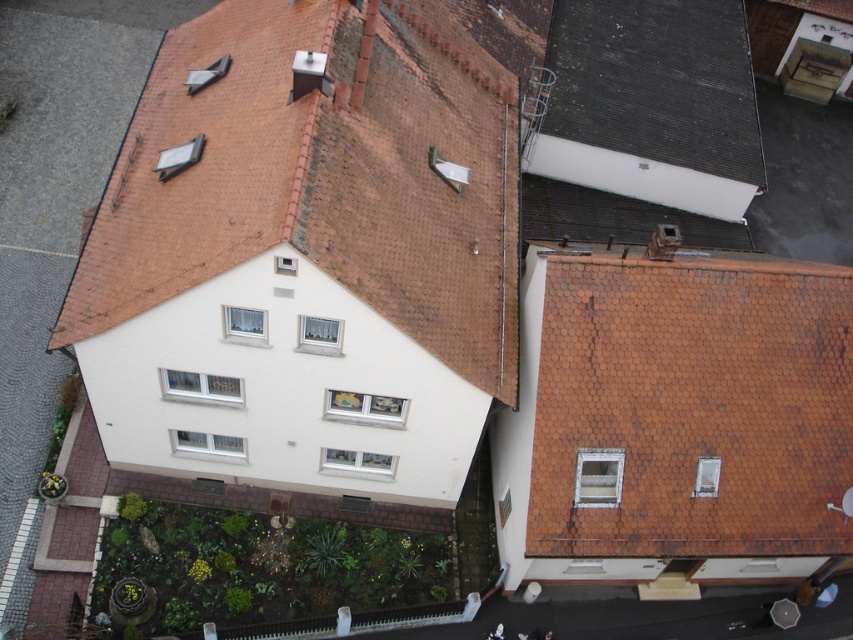
Which is above, brown tile roof at upper center or black shingles at upper center?

black shingles at upper center is above.

Between brown tile roof at upper center and black shingles at upper center, which one appears on the left side from the viewer's perspective?

Positioned to the left is brown tile roof at upper center.

Is point (281, 38) closer to viewer compared to point (691, 99)?

Yes.

The height and width of the screenshot is (640, 853). Identify the location of brown tile roof at upper center. (321, 176).